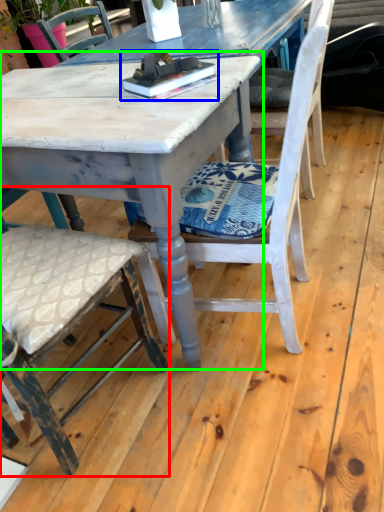
Question: Which object is positioned farthest from chair (highlighted by a red box)? Select from book (highlighted by a blue box) and round table (highlighted by a green box).

Choices:
 (A) book
 (B) round table

Answer: (A)